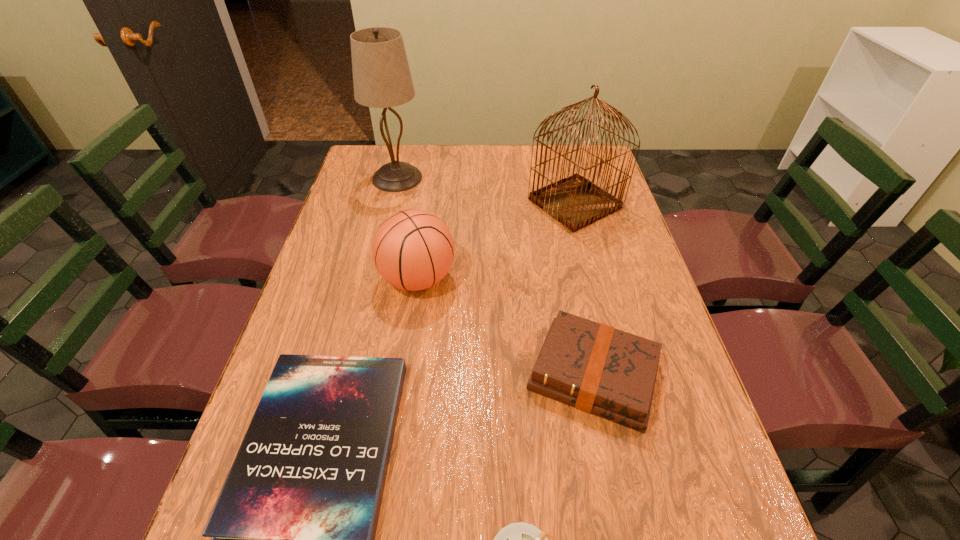
Find the location of `vacant space that is in between the tallest object and the right hardback book`. vacant space that is in between the tallest object and the right hardback book is located at coordinates (495, 276).

Locate an element on the screen. The height and width of the screenshot is (540, 960). free area in between the third shortest object and the birdcage is located at coordinates 584,289.

Find the location of a particular element. This screenshot has height=540, width=960. vacant area that lies between the right hardback book and the basketball is located at coordinates (506, 327).

Locate an element on the screen. object identified as the fourth closest to the fourth tallest object is located at coordinates (576, 202).

Find the location of a particular element. The image size is (960, 540). the second closest object to the third farthest object is located at coordinates (598, 369).

Locate an element on the screen. vacant region that satisfies the following two spatial constraints: 1. on the front-facing side of the birdcage; 2. on the left side of the tallest object is located at coordinates (391, 204).

The height and width of the screenshot is (540, 960). In order to click on vacant area that satisfies the following two spatial constraints: 1. on the front-facing side of the fifth shortest object; 2. on the right side of the lampshade in this screenshot , I will do `click(391, 204)`.

The height and width of the screenshot is (540, 960). Identify the location of vacant position in the image that satisfies the following two spatial constraints: 1. on the front-facing side of the second tallest object; 2. on the left side of the tallest object. (391, 204).

Locate an element on the screen. This screenshot has width=960, height=540. vacant area in the image that satisfies the following two spatial constraints: 1. on the front-facing side of the basketball; 2. on the left side of the lampshade is located at coordinates (372, 279).